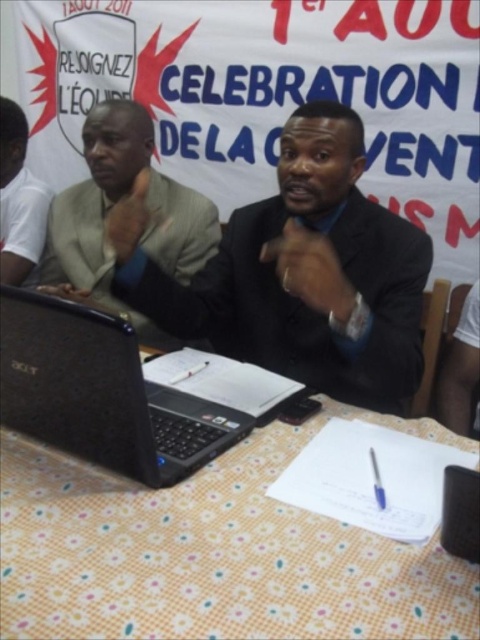
Who is positioned more to the left, black matte laptop at center or light beige suit at center?

Positioned to the left is light beige suit at center.

Is point (94, 376) positioned after point (147, 122)?

No, it is in front of (147, 122).

You are a GUI agent. You are given a task and a screenshot of the screen. Output one action in this format:
    pyautogui.click(x=<x>, y=<y>)
    Task: Click on the black matte laptop at center
    Image resolution: width=480 pixels, height=640 pixels.
    Given the screenshot: What is the action you would take?
    pyautogui.click(x=100, y=394)

Between yellow floral tablecloth at lower center and white cotton shirt at left, which one has less height?

With less height is yellow floral tablecloth at lower center.

From the picture: Does yellow floral tablecloth at lower center come behind white cotton shirt at left?

No, yellow floral tablecloth at lower center is closer to the viewer.

Measure the distance between point [60,609] and camera.

They are 21.26 inches apart.

The width and height of the screenshot is (480, 640). I want to click on yellow floral tablecloth at lower center, so click(x=214, y=552).

Is white cotton shirt at left smaller than blue glossy pen at center?

Actually, white cotton shirt at left might be larger than blue glossy pen at center.

Does white cotton shirt at left come in front of blue glossy pen at center?

No, white cotton shirt at left is further to the viewer.

Locate an element on the screen. The image size is (480, 640). white cotton shirt at left is located at coordinates (19, 198).